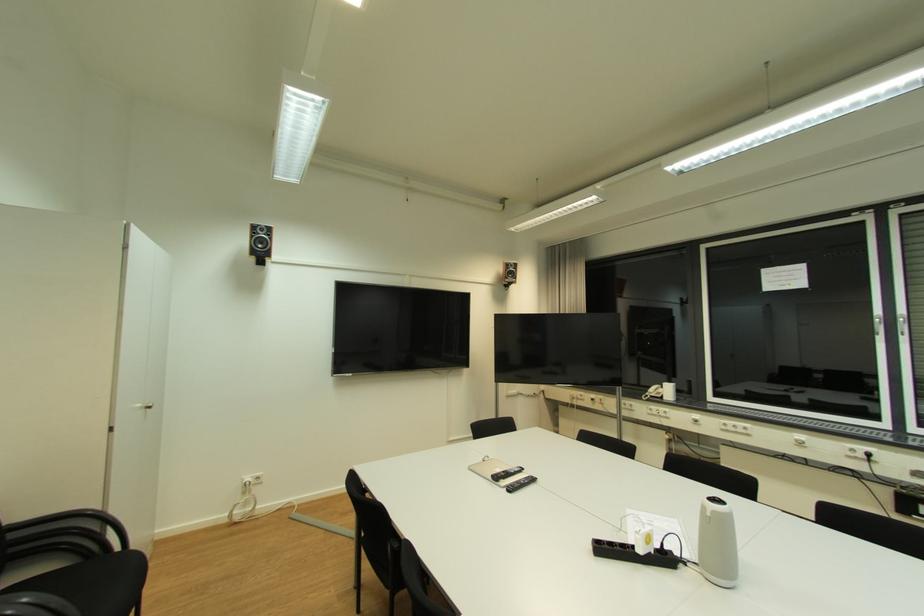
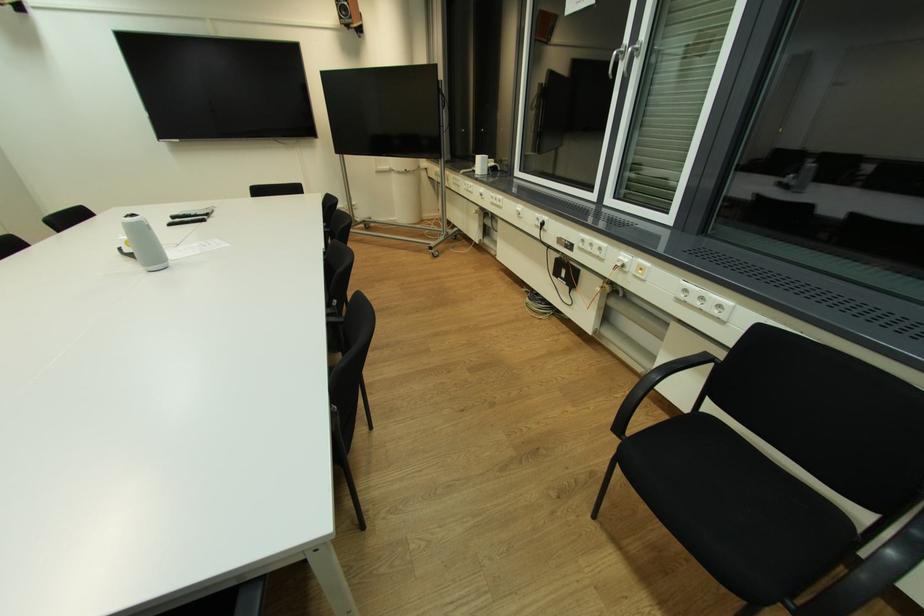
Where in the second image is the point corresponding to (882,321) from the first image?

(621, 54)